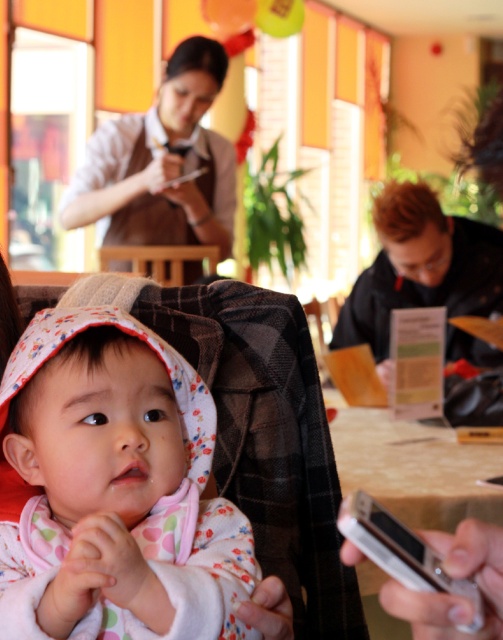
You are standing in a restaurant and want to take a photo of the point at coordinates (79,317). The camera you are using has a minimum focus distance of 30 inches. Will the camera be able to focus on the point?

The point at coordinates (79,317) is 29.19 inches away from the camera, which is less than the minimum focus distance of 30 inches. Therefore, the camera may not be able to focus on the point.

You are a photographer positioned at the entrance of the room. You want to take a photo of the floral fabric baby at center. Considering the baby is at coordinates point 0.767, 0.231, will you need to adjust your camera angle to capture the baby in the frame?

The floral fabric baby at center is located at point (116,490), which means it is positioned towards the right side of the frame. Since the photographer is at the entrance, they will need to adjust their camera angle to the right to ensure the baby is centered in the photo.

You are a parent in the image and want to place a small toy for your baby who is sitting at the center. The toy needs to be placed at point (116, 490). Is this point near the baby?

Yes, the point (116, 490) is where the floral fabric baby at center is located, so placing the toy there would be right next to the baby.